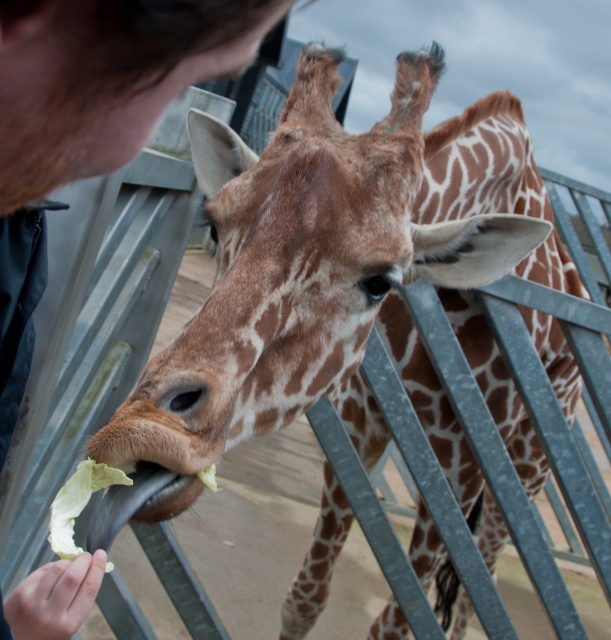
What is the color and position of the object at point (95, 99)?

The object at point (95, 99) is dark brown hair at upper left.

You are a zookeeper observing the giraffe and the person feeding it. You notice something unusual in the image. What is the dark brown hair at upper left doing in this scene?

The dark brown hair at upper left is part of the person feeding the giraffe, indicating that the person has dark brown hair at upper left.